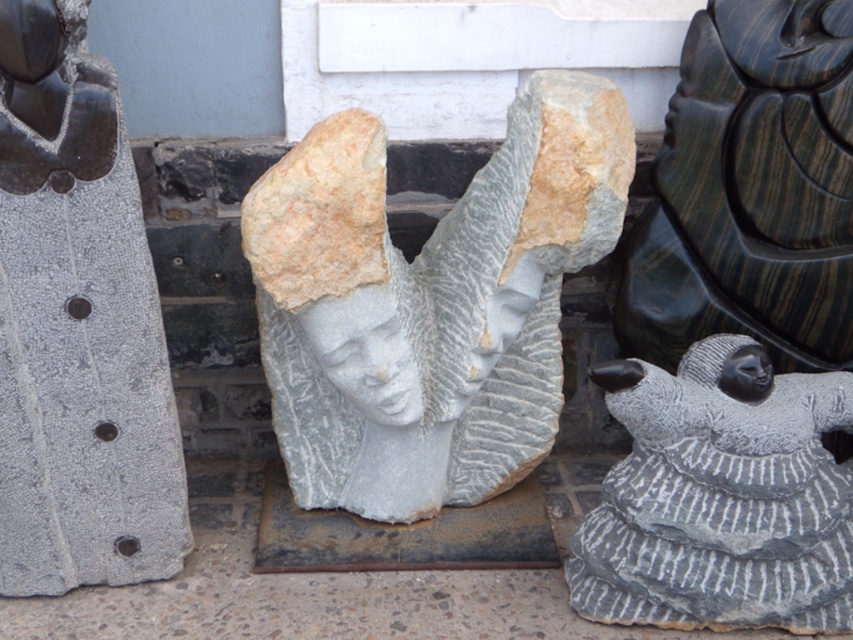
Please provide the 2D coordinates of the black glossy head at upper left in the image. The coordinates should be in the format of a tuple with two decimal numbers, like this example format for coordinates in an image coordinate system where the origin is at the upper left corner of the image. For example, the answer could be something like 0.056, 0.045. Please do not add any extra text or explanation, just the coordinates in the format specified.

(38, 35)